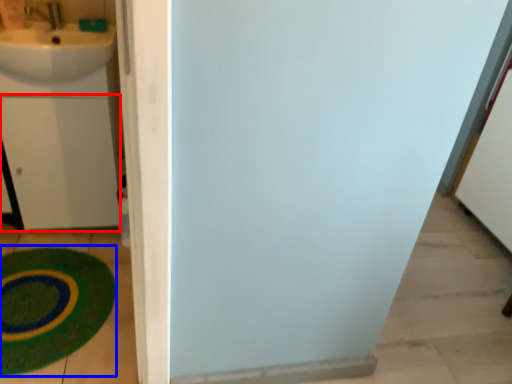
Question: Which of the following is the farthest to the observer, drawer (highlighted by a red box) or bath mat (highlighted by a blue box)?

Choices:
 (A) drawer
 (B) bath mat

Answer: (A)